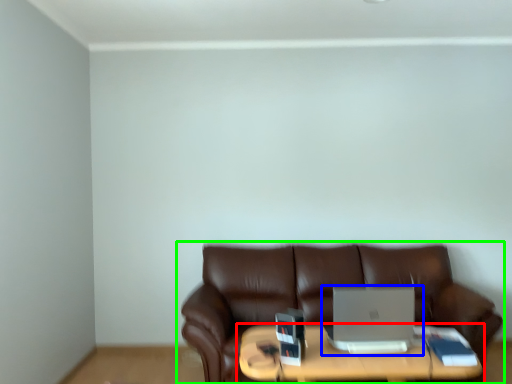
Question: Which object is the farthest from table (highlighted by a red box)? Choose among these: laptop (highlighted by a blue box) or studio couch (highlighted by a green box).

Choices:
 (A) laptop
 (B) studio couch

Answer: (B)